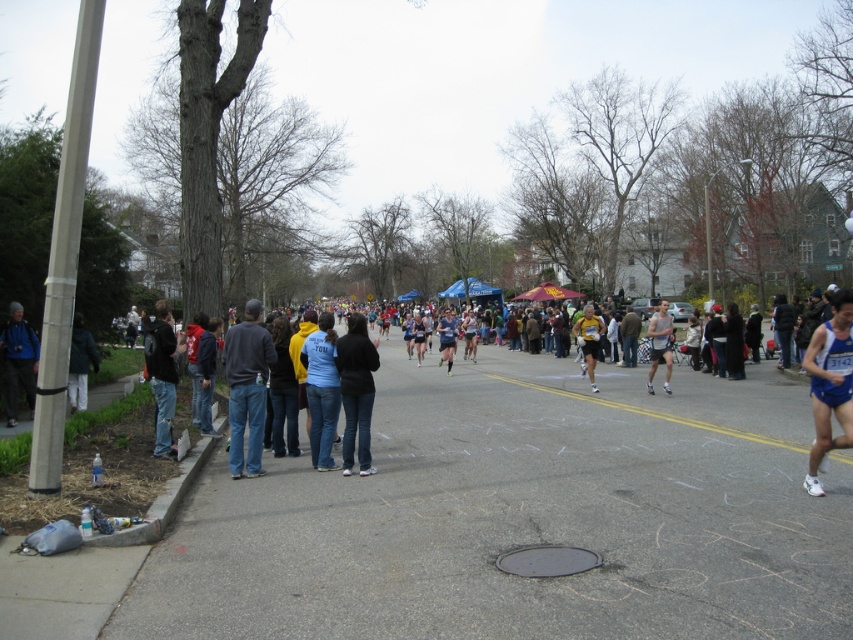
Question: Which of the following is the closest to the observer?

Choices:
 (A) blue fabric runner at right
 (B) yellow athletic wear at center
 (C) matte blue jacket at left
 (D) jeans at left

Answer: (A)

Question: Is gray asphalt road at lower center bigger than yellow athletic wear at center?

Choices:
 (A) yes
 (B) no

Answer: (A)

Question: Among these objects, which one is nearest to the camera?

Choices:
 (A) dark gray jeans at left
 (B) yellow athletic wear at center

Answer: (A)

Question: Based on their relative distances, which object is nearer to the matte blue jacket at left?

Choices:
 (A) light blue denim jeans at center
 (B) jeans at left
 (C) dark gray jacket at left

Answer: (C)

Question: Is gray asphalt road at lower center positioned in front of blue athletic shorts at center?

Choices:
 (A) yes
 (B) no

Answer: (A)

Question: From the image, what is the correct spatial relationship of dark gray jeans at left in relation to matte blue jacket at left?

Choices:
 (A) right
 (B) left

Answer: (A)